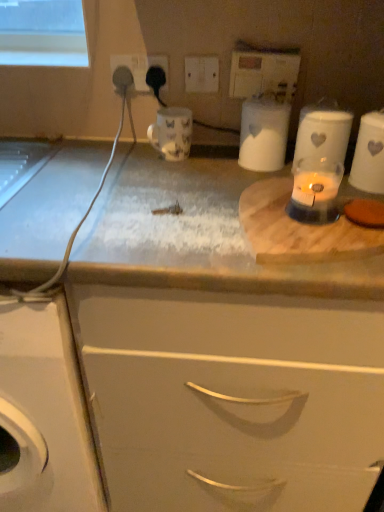
Where is `free space in front of white matte container at upper center, the second appliance in the right-to-left sequence`? The image size is (384, 512). free space in front of white matte container at upper center, the second appliance in the right-to-left sequence is located at coordinates (247, 180).